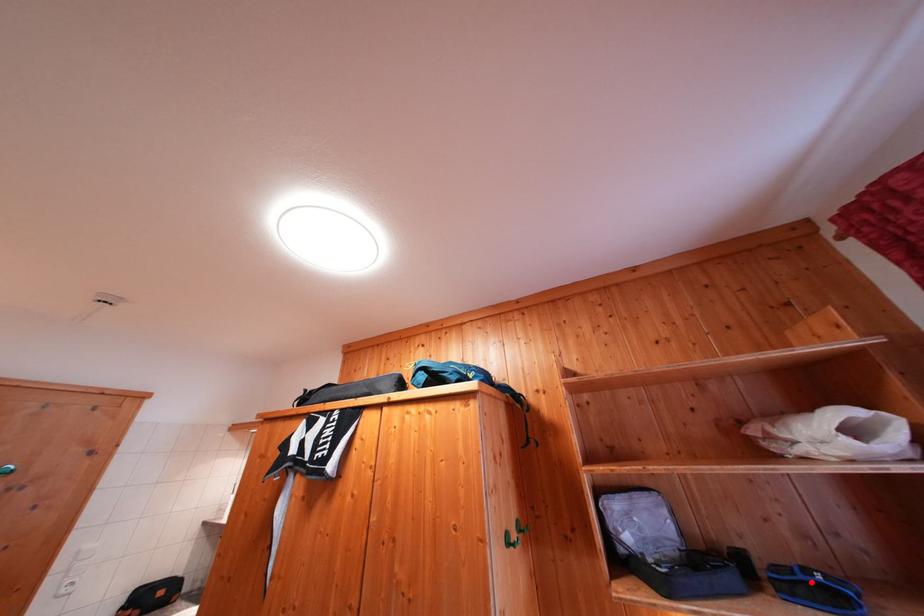
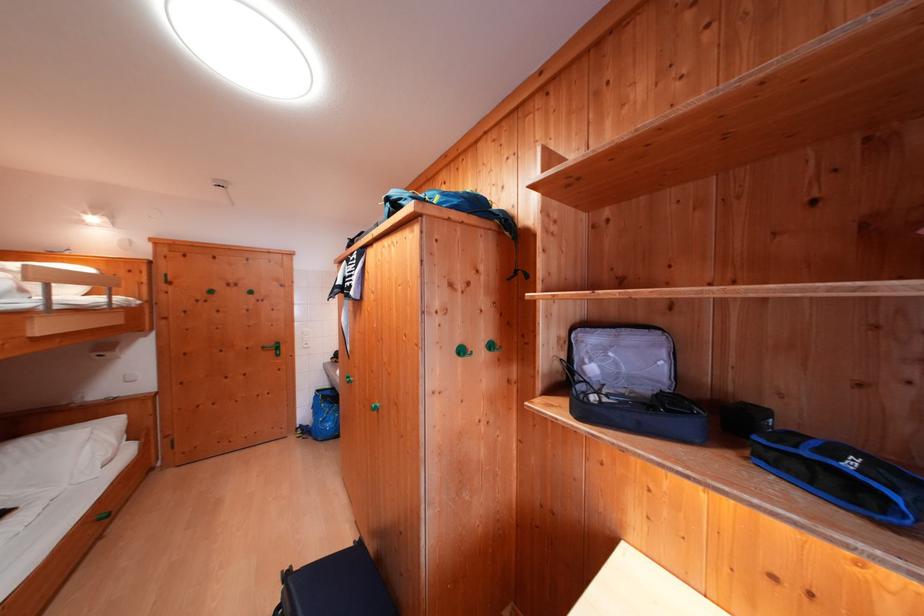
Find the pixel in the second image that matches the highlighted location in the first image.

(815, 456)